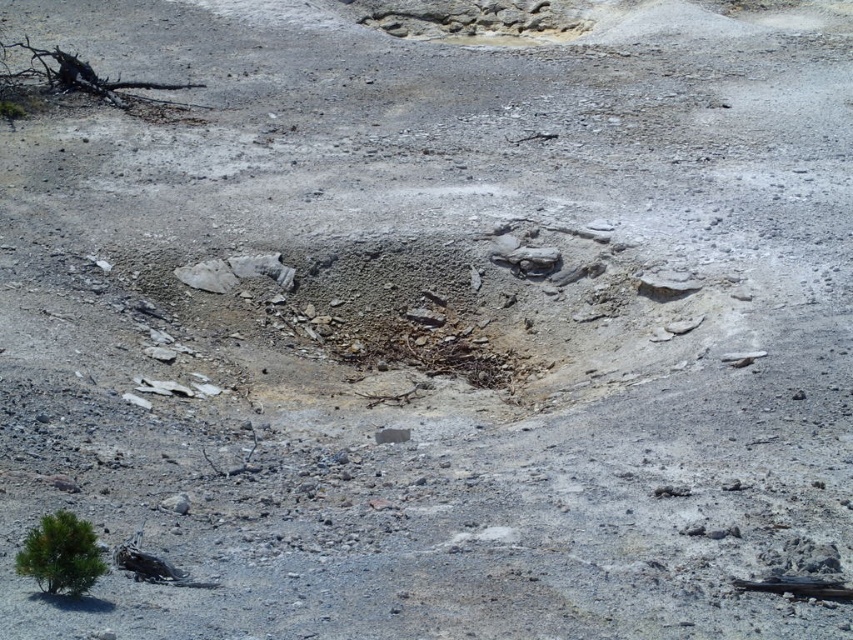
Who is taller, green matte tree at lower left or black charred wood at upper left?

Standing taller between the two is black charred wood at upper left.

Which is above, green matte tree at lower left or black charred wood at upper left?

black charred wood at upper left is higher up.

Who is more forward, (x=38, y=536) or (x=32, y=58)?

Point (x=38, y=536) is in front.

I want to click on green matte tree at lower left, so click(x=61, y=554).